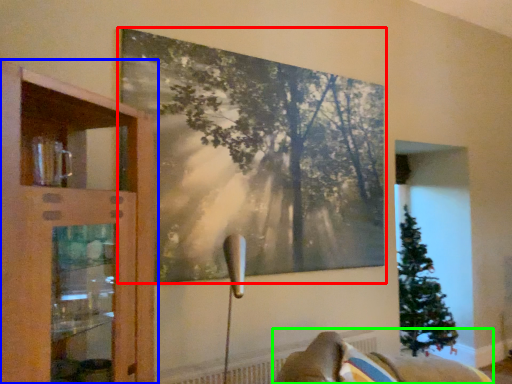
Question: Based on their relative distances, which object is nearer to picture frame (highlighted by a red box)? Choose from cupboard (highlighted by a blue box) and furniture (highlighted by a green box).

Choices:
 (A) cupboard
 (B) furniture

Answer: (A)